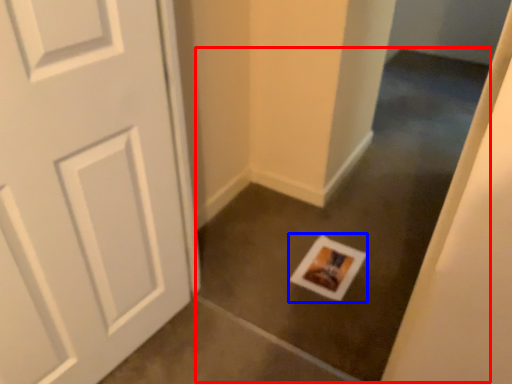
Question: Which of the following is the farthest to the observer, concrete (highlighted by a red box) or postcard (highlighted by a blue box)?

Choices:
 (A) concrete
 (B) postcard

Answer: (B)